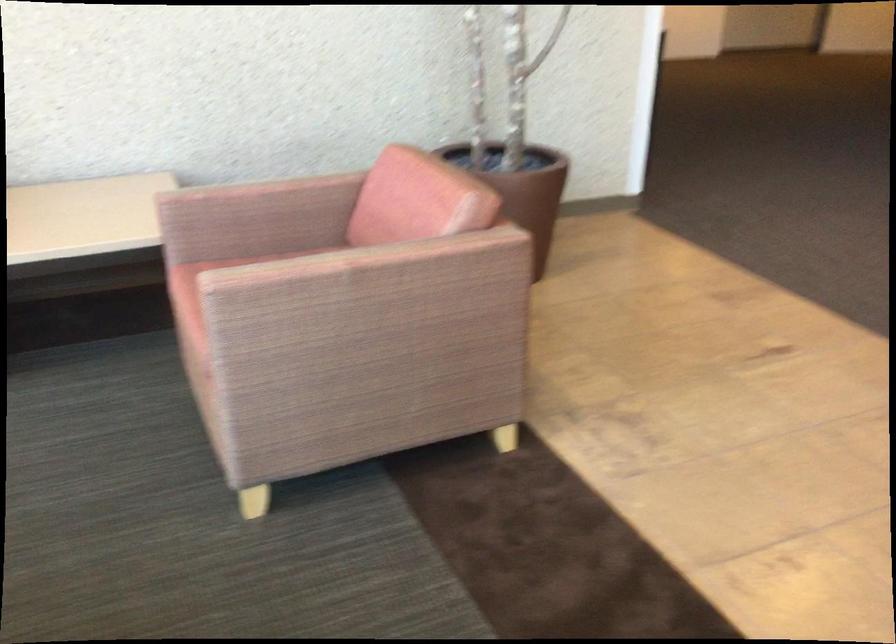
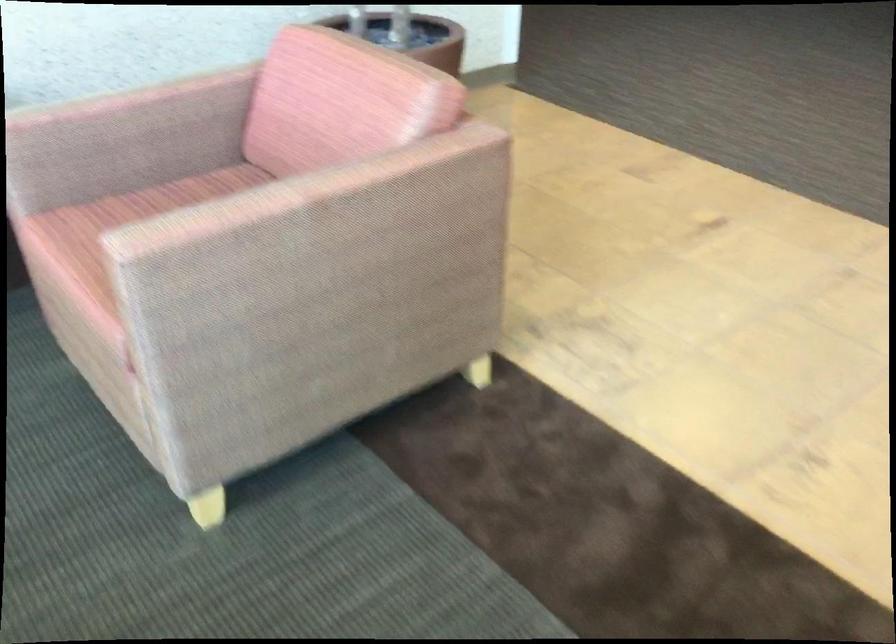
The point at (342, 260) is marked in the first image. Where is the corresponding point in the second image?

(298, 192)